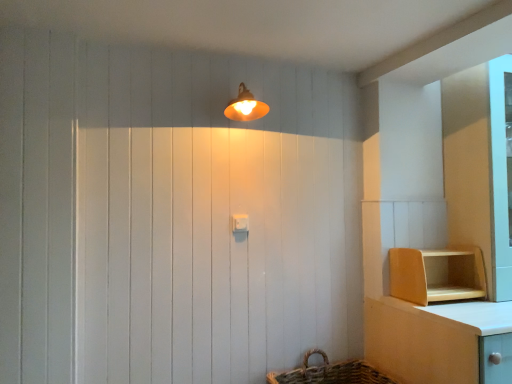
What are the coordinates of `white plastic light switch at center` in the screenshot? It's located at (240, 223).

Is wooden shelf at lower right far from matte orange lampshade at upper center?

Yes, wooden shelf at lower right and matte orange lampshade at upper center are quite far apart.

From the image's perspective, which is below, wooden shelf at lower right or matte orange lampshade at upper center?

From the image's view, wooden shelf at lower right is below.

Looking at this image, considering the relative positions of wooden shelf at lower right and matte orange lampshade at upper center in the image provided, is wooden shelf at lower right to the left of matte orange lampshade at upper center from the viewer's perspective?

Incorrect, wooden shelf at lower right is not on the left side of matte orange lampshade at upper center.

Is point (484, 277) positioned after point (248, 111)?

No, it is in front of (248, 111).

Between point (244, 111) and point (407, 257), which one is positioned behind?

Positioned behind is point (244, 111).

Between matte orange lampshade at upper center and wooden shelf at lower right, which one is positioned behind?

wooden shelf at lower right is further from the camera.

Is matte orange lampshade at upper center not close to wooden shelf at lower right?

matte orange lampshade at upper center is positioned a significant distance from wooden shelf at lower right.

Would you say white plastic light switch at center is inside or outside wooden shelf at lower right?

white plastic light switch at center is located beyond the bounds of wooden shelf at lower right.

Between point (234, 223) and point (415, 303), which one is positioned behind?

The point (234, 223) is behind.

Is white plastic light switch at center placed right next to wooden shelf at lower right?

white plastic light switch at center and wooden shelf at lower right are not in contact.

Can you confirm if white plastic light switch at center is wider than wooden shelf at lower right?

No.

Does wooden shelf at lower right lie in front of white plastic light switch at center?

Yes, wooden shelf at lower right is closer to the viewer.

Is wooden shelf at lower right wider than white plastic light switch at center?

Correct, the width of wooden shelf at lower right exceeds that of white plastic light switch at center.

Is point (435, 282) positioned behind point (247, 217)?

That is True.

Who is bigger, wooden shelf at lower right or white plastic light switch at center?

With larger size is wooden shelf at lower right.

In the scene shown: Is white plastic light switch at center inside matte orange lampshade at upper center?

No, white plastic light switch at center is not a part of matte orange lampshade at upper center.

Is matte orange lampshade at upper center bigger or smaller than white plastic light switch at center?

Considering their sizes, matte orange lampshade at upper center takes up more space than white plastic light switch at center.

Which object is closer to the camera, matte orange lampshade at upper center or white plastic light switch at center?

matte orange lampshade at upper center.

From a real-world perspective, between white plastic light switch at center and matte orange lampshade at upper center, who is vertically higher?

matte orange lampshade at upper center is physically above.

In order to click on light switch that appears behind the matte orange lampshade at upper center in this screenshot , I will do `click(240, 223)`.

From the image's perspective, is white plastic light switch at center located beneath matte orange lampshade at upper center?

Yes.

Looking at this image, does white plastic light switch at center appear on the left side of matte orange lampshade at upper center?

Indeed, white plastic light switch at center is positioned on the left side of matte orange lampshade at upper center.

Find the location of `shelf below the matte orange lampshade at upper center (from a real-world perspective)`. shelf below the matte orange lampshade at upper center (from a real-world perspective) is located at coordinates (437, 274).

Where is `light fixture located in front of the wooden shelf at lower right`? The height and width of the screenshot is (384, 512). light fixture located in front of the wooden shelf at lower right is located at coordinates (245, 106).

Considering their positions, is white plastic light switch at center positioned further to wooden shelf at lower right than matte orange lampshade at upper center?

matte orange lampshade at upper center is positioned further to the anchor wooden shelf at lower right.

From the image, which object appears to be nearer to wooden shelf at lower right, matte orange lampshade at upper center or white plastic light switch at center?

Among the two, white plastic light switch at center is located nearer to wooden shelf at lower right.

From the image, which object appears to be nearer to matte orange lampshade at upper center, white plastic light switch at center or wooden shelf at lower right?

The object closer to matte orange lampshade at upper center is white plastic light switch at center.

Estimate the real-world distances between objects in this image. Which object is further from white plastic light switch at center, matte orange lampshade at upper center or wooden shelf at lower right?

Among the two, wooden shelf at lower right is located further to white plastic light switch at center.

Based on their spatial positions, is wooden shelf at lower right or white plastic light switch at center further from matte orange lampshade at upper center?

wooden shelf at lower right is further to matte orange lampshade at upper center.

When comparing their distances from white plastic light switch at center, does wooden shelf at lower right or matte orange lampshade at upper center seem further?

Among the two, wooden shelf at lower right is located further to white plastic light switch at center.

At what (x,y) coordinates should I click in order to perform the action: click on light fixture located between white plastic light switch at center and wooden shelf at lower right in the left-right direction. Please return your answer as a coordinate pair (x, y). The width and height of the screenshot is (512, 384). Looking at the image, I should click on (245, 106).